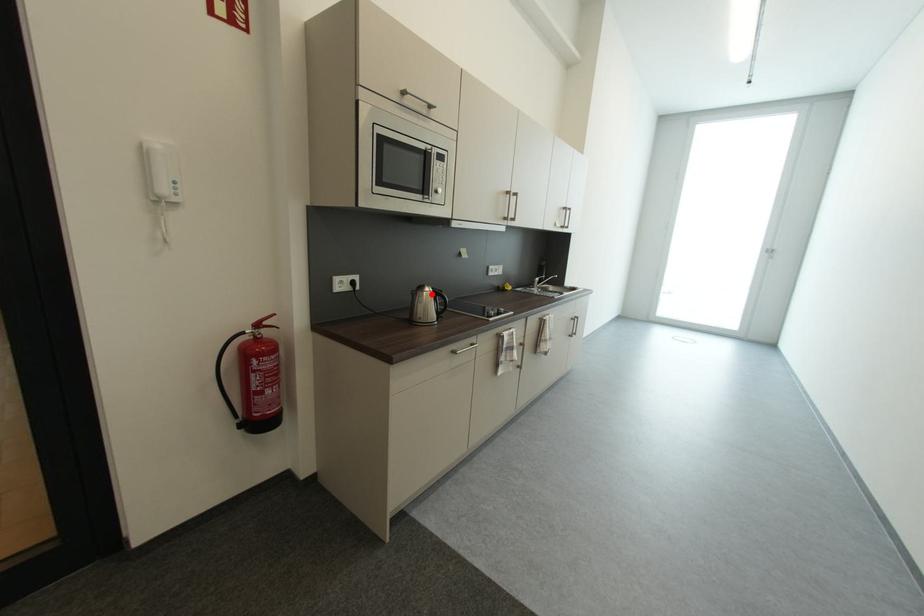
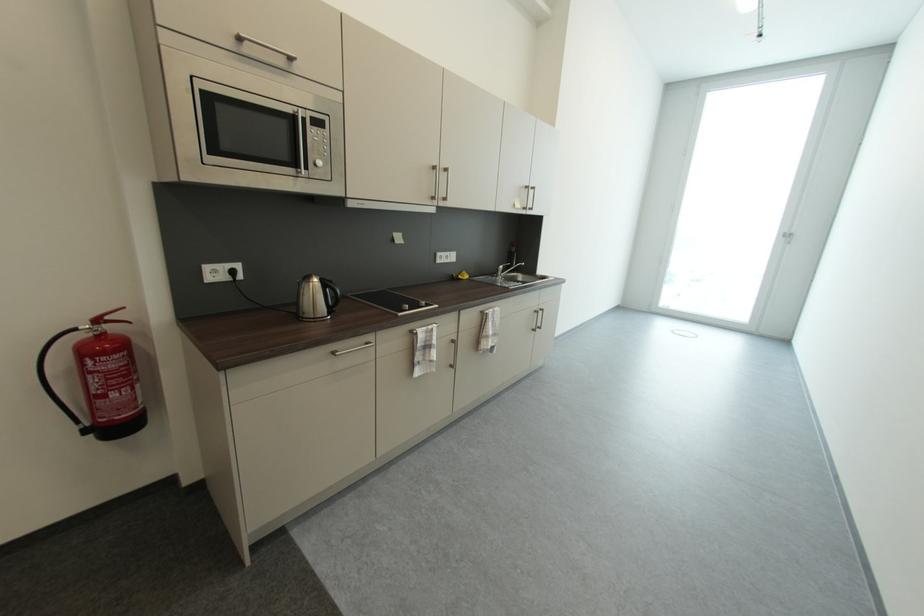
Where in the second image is the point corresponding to the highlighted location from the first image?

(317, 285)